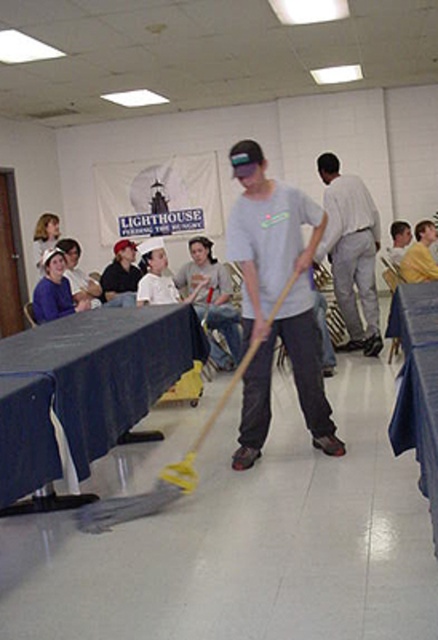
You are organizing a charity event and need to ensure that all volunteers are wearing appropriate clothing. Looking at the image, which volunteer has clothing with a larger size between the matte gray shirt at center and the dark blue jeans at center?

The matte gray shirt at center is bigger than the dark blue jeans at center, so the volunteer wearing the matte gray shirt at center has clothing with a larger size.

You are an observer in the room. You see the blue fabric tablecloth at lower left and the yellow shirt at upper right. Which object is located to the left of the other?

The blue fabric tablecloth at lower left is positioned on the left side of yellow shirt at upper right.